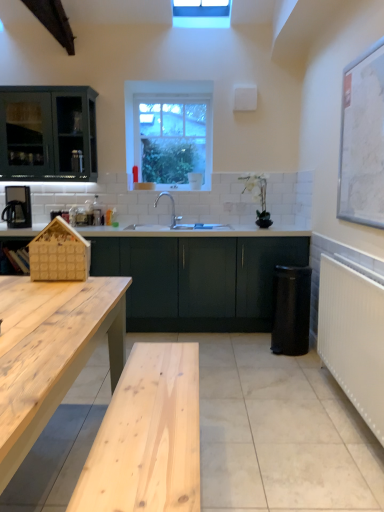
Question: From a real-world perspective, is white textured radiator at right on matte black kettle at left?

Choices:
 (A) yes
 (B) no

Answer: (B)

Question: From the image's perspective, is white textured radiator at right over matte black kettle at left?

Choices:
 (A) yes
 (B) no

Answer: (B)

Question: Is white textured radiator at right aimed at matte black kettle at left?

Choices:
 (A) yes
 (B) no

Answer: (A)

Question: Does white textured radiator at right have a lesser width compared to matte black kettle at left?

Choices:
 (A) no
 (B) yes

Answer: (B)

Question: Can you confirm if white textured radiator at right is positioned to the right of matte black kettle at left?

Choices:
 (A) yes
 (B) no

Answer: (A)

Question: Is point (344, 178) closer or farther from the camera than point (52, 224)?

Choices:
 (A) closer
 (B) farther

Answer: (B)

Question: Looking at the image, does white matte map at upper right seem bigger or smaller compared to wooden house at left?

Choices:
 (A) big
 (B) small

Answer: (A)

Question: Based on their positions, is white matte map at upper right located to the left or right of wooden house at left?

Choices:
 (A) left
 (B) right

Answer: (B)

Question: Relative to wooden house at left, is white matte map at upper right in front or behind?

Choices:
 (A) behind
 (B) front

Answer: (B)

Question: From the image's perspective, relative to matte green cabinet at center, is natural wood table at left above or below?

Choices:
 (A) above
 (B) below

Answer: (B)

Question: From a real-world perspective, is natural wood table at left positioned above or below matte green cabinet at center?

Choices:
 (A) below
 (B) above

Answer: (A)

Question: In the image, is natural wood table at left positioned in front of or behind matte green cabinet at center?

Choices:
 (A) front
 (B) behind

Answer: (A)

Question: Is natural wood table at left taller or shorter than matte green cabinet at center?

Choices:
 (A) short
 (B) tall

Answer: (A)

Question: Relative to natural wood table at left, is matte black kettle at left in front or behind?

Choices:
 (A) behind
 (B) front

Answer: (A)

Question: In terms of width, does matte black kettle at left look wider or thinner when compared to natural wood table at left?

Choices:
 (A) thin
 (B) wide

Answer: (A)